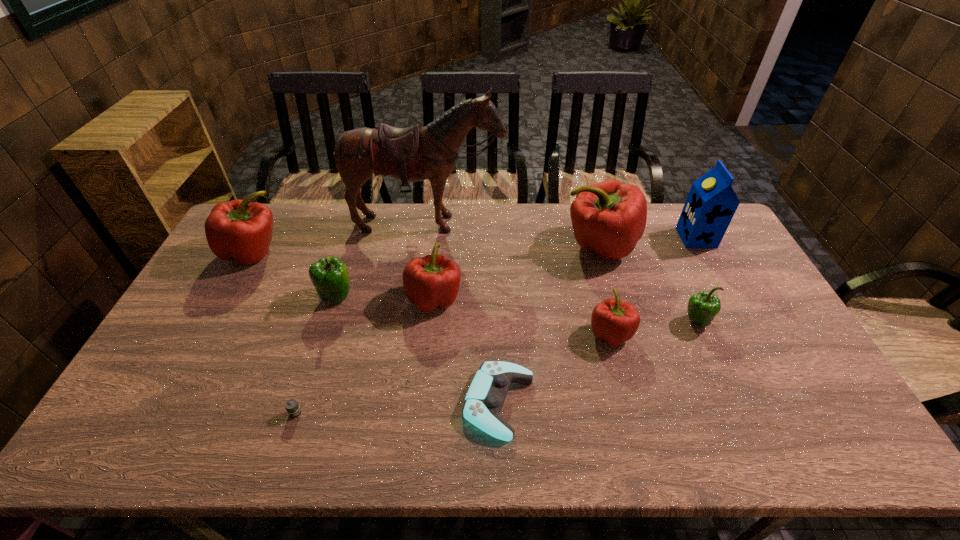
Identify the location of saddle. (416, 153).

Locate an element on the screen. the tallest object is located at coordinates (416, 153).

Locate an element on the screen. The height and width of the screenshot is (540, 960). the rightmost object is located at coordinates (711, 204).

Identify the location of carton. Image resolution: width=960 pixels, height=540 pixels. (711, 204).

Identify the location of the biggest pink bell pepper. The image size is (960, 540). (609, 217).

Where is `the third smallest pink bell pepper`? The height and width of the screenshot is (540, 960). the third smallest pink bell pepper is located at coordinates (239, 230).

You are a GUI agent. You are given a task and a screenshot of the screen. Output one action in this format:
    pyautogui.click(x=<x>, y=<y>)
    Task: Click on the leftmost object
    
    Given the screenshot: What is the action you would take?
    pyautogui.click(x=239, y=230)

This screenshot has height=540, width=960. Find the location of `the left green bell pepper`. the left green bell pepper is located at coordinates (329, 275).

Image resolution: width=960 pixels, height=540 pixels. Find the location of `the bigger green bell pepper`. the bigger green bell pepper is located at coordinates (329, 275).

This screenshot has height=540, width=960. I want to click on the third bell pepper from left to right, so click(x=433, y=281).